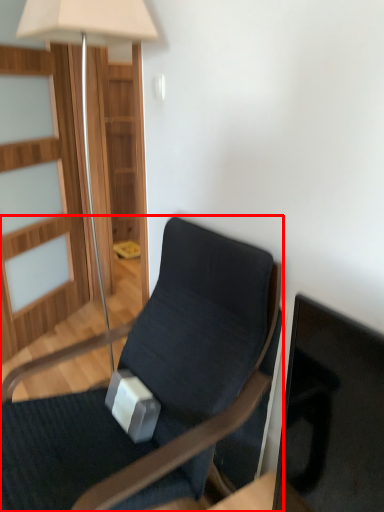
Question: From the image's perspective, what is the correct spatial relationship of chair (annotated by the red box) in relation to lamp?

Choices:
 (A) above
 (B) below

Answer: (B)